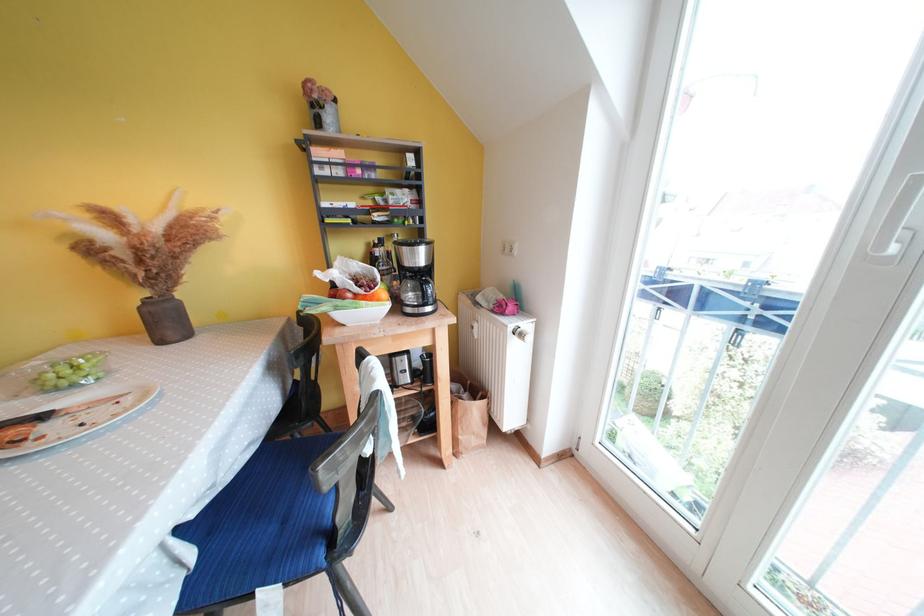
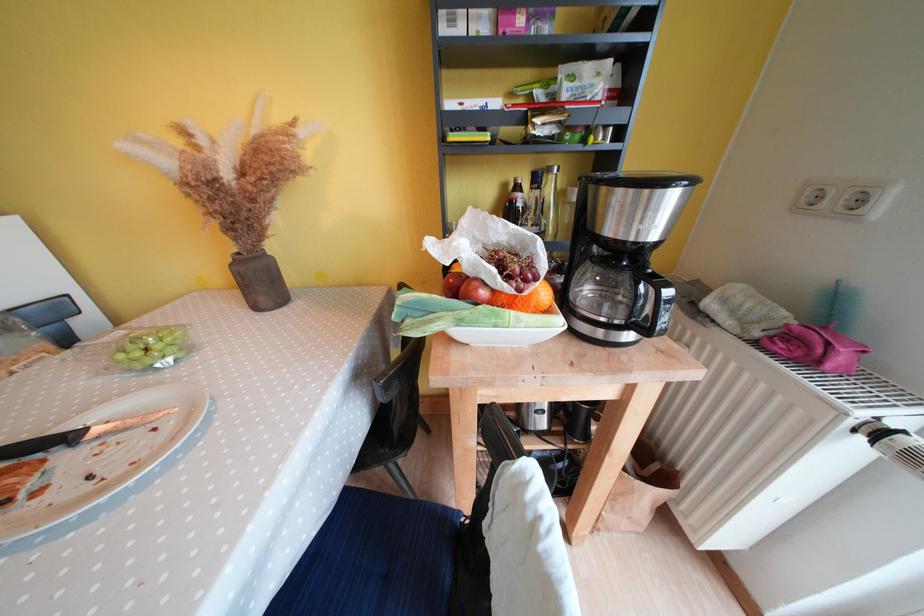
Question: Based on the continuous images, in which direction is the camera rotating? Reply with the corresponding letter.

Choices:
 (A) Left
 (B) Right
 (C) Up
 (D) Down

Answer: (A)